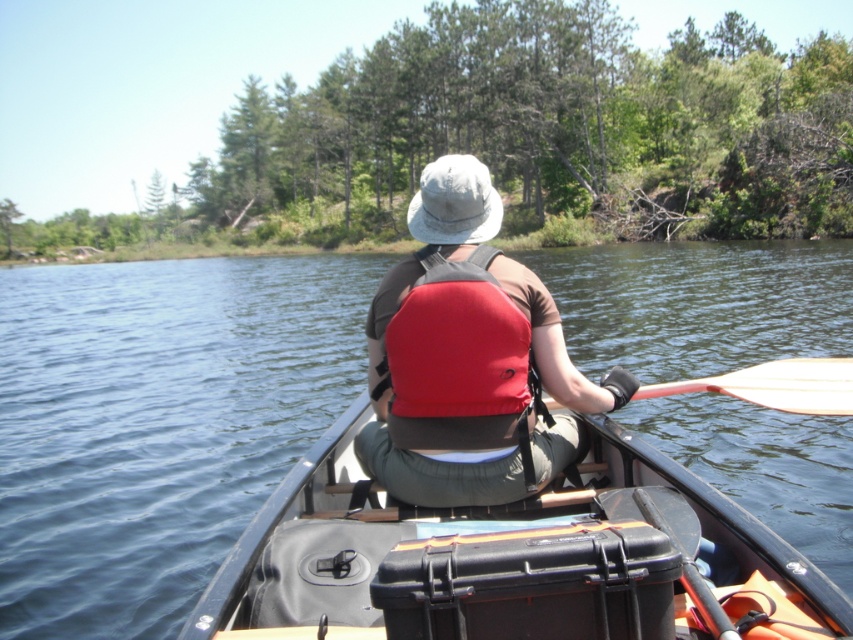
Question: Observing the image, what is the correct spatial positioning of red fabric life jacket at center in reference to wooden smooth paddle at right?

Choices:
 (A) above
 (B) below

Answer: (A)

Question: Is black plastic boat at center positioned in front of red fabric life jacket at center?

Choices:
 (A) yes
 (B) no

Answer: (A)

Question: Does black plastic boat at center have a larger size compared to wooden smooth paddle at right?

Choices:
 (A) yes
 (B) no

Answer: (A)

Question: Which point appears closest to the camera in this image?

Choices:
 (A) (431, 438)
 (B) (318, 628)
 (C) (741, 394)

Answer: (B)

Question: Which object is the farthest from the red fabric life jacket at center?

Choices:
 (A) black plastic boat at center
 (B) red fabric life vest at center

Answer: (A)

Question: Which object is farther from the camera taking this photo?

Choices:
 (A) wooden smooth paddle at right
 (B) red fabric life vest at center
 (C) black plastic boat at center
 (D) red fabric life jacket at center

Answer: (A)